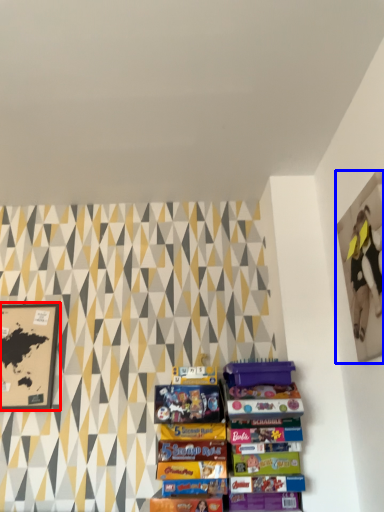
Question: Which object appears closest to the camera in this image, picture frame (highlighted by a red box) or picture frame (highlighted by a blue box)?

Choices:
 (A) picture frame
 (B) picture frame

Answer: (B)